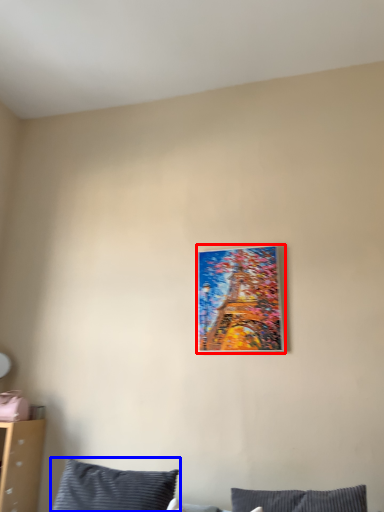
Question: Which object is closer to the camera taking this photo, picture frame (highlighted by a red box) or pillow (highlighted by a blue box)?

Choices:
 (A) picture frame
 (B) pillow

Answer: (B)